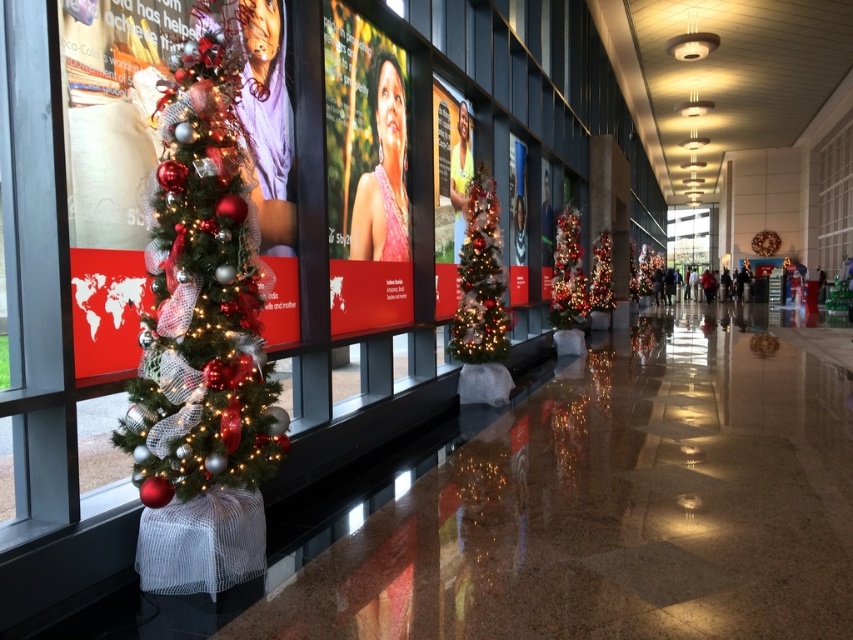
Question: Which point is farther to the camera?

Choices:
 (A) (607, 241)
 (B) (175, 280)
 (C) (473, 336)

Answer: (A)

Question: Does shiny silver christmas tree at center appear on the right side of shiny silver tinsel at center?

Choices:
 (A) yes
 (B) no

Answer: (B)

Question: Which is nearer to the shiny silver tinsel at center?

Choices:
 (A) shiny red christmas tree at center
 (B) shiny silver christmas tree at center

Answer: (A)

Question: Does shiny red and silver christmas tree at left appear over shiny silver christmas tree at center?

Choices:
 (A) no
 (B) yes

Answer: (A)

Question: Is shiny red and silver christmas tree at left to the right of shiny silver tinsel at center from the viewer's perspective?

Choices:
 (A) no
 (B) yes

Answer: (A)

Question: Considering the real-world distances, which object is closest to the shiny silver christmas tree at center?

Choices:
 (A) shiny silver tinsel at center
 (B) shiny red and silver christmas tree at left

Answer: (B)